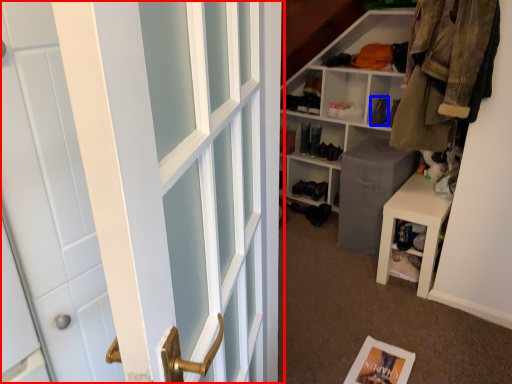
Question: Which point is closer to the camera, door (highlighted by a red box) or shoe (highlighted by a blue box)?

Choices:
 (A) door
 (B) shoe

Answer: (A)